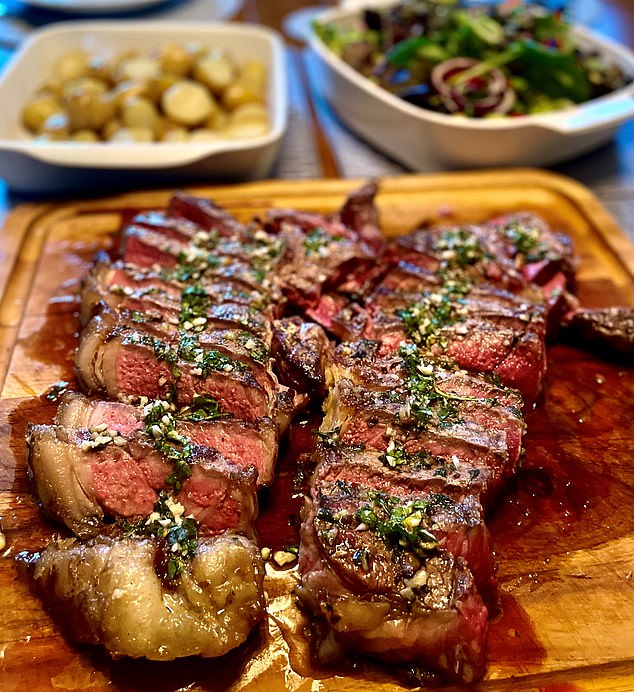
Locate an element on the screen. white dish top right is located at coordinates point(564,127).